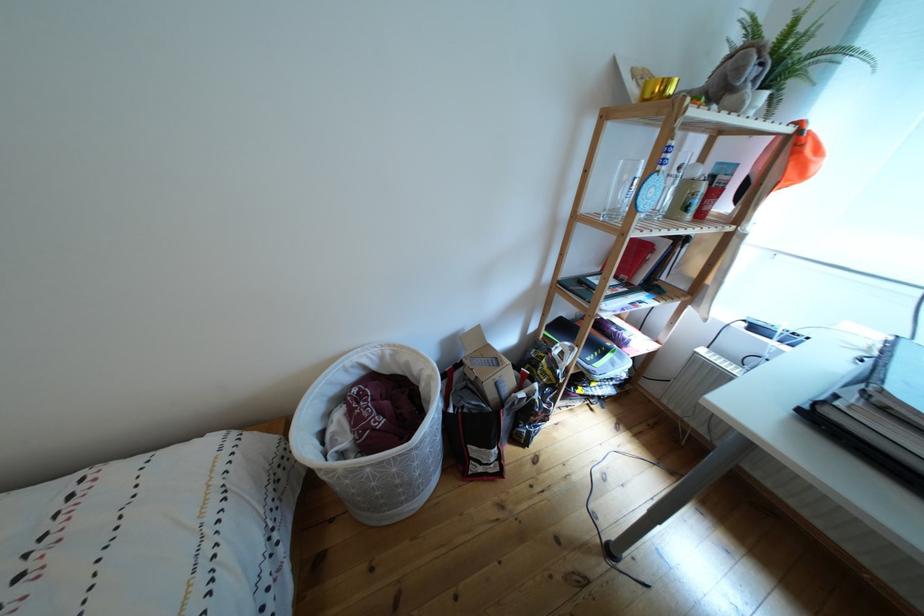
Where is `white plant pot`? The image size is (924, 616). white plant pot is located at coordinates (756, 102).